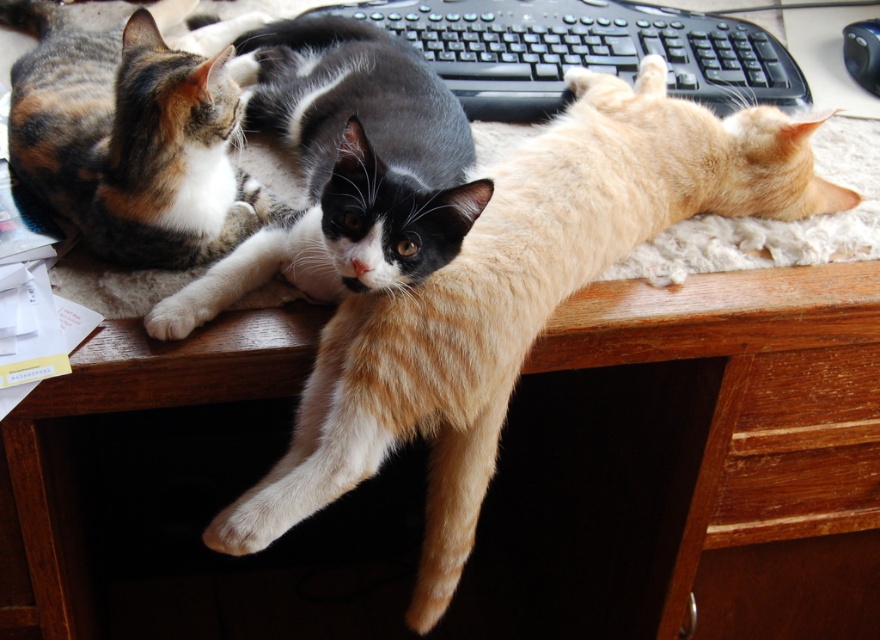
Consider the image. You are trying to place a small toy mouse on the desk between the calico fur cat at upper left and the black plastic keyboard at upper center. Which object is taller so that the toy mouse can be placed in front of it?

The calico fur cat at upper left is taller than the black plastic keyboard at upper center, so you should place the toy mouse in front of the calico fur cat at upper left.

You are a cat owner who wants to place a new toy on the desk. The wooden drawer at lower right is where you usually keep your cat toys. However, there is a calico fur cat at center currently blocking access to the drawer. Can you reach the drawer without disturbing the cat?

The calico fur cat at center is in front of the wooden drawer at lower right, so you cannot reach the drawer without moving the cat first.

You are organizing the desk and need to move the calico fur cat at center and the wooden drawer at lower right. Which object is wider?

The calico fur cat at center is wider than the wooden drawer at lower right.